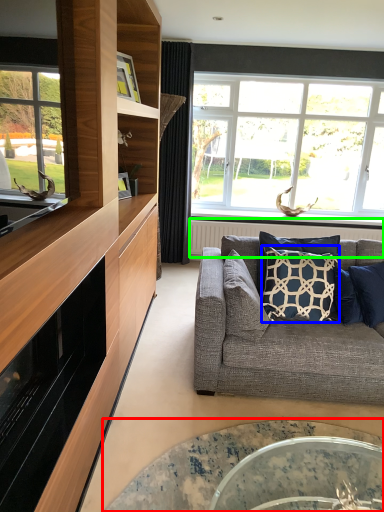
Question: Estimate the real-world distances between objects in this image. Which object is closer to coffee table (highlighted by a red box), pillow (highlighted by a blue box) or radiator (highlighted by a green box)?

Choices:
 (A) pillow
 (B) radiator

Answer: (A)